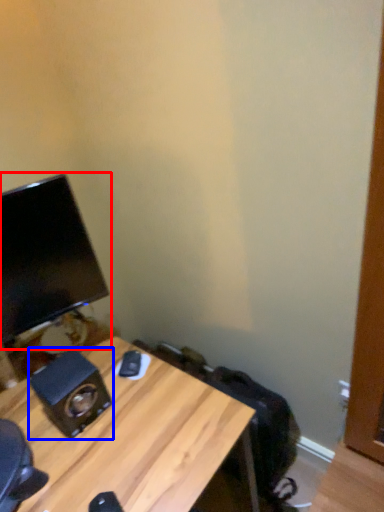
Question: Which point is closer to the camera, computer monitor (highlighted by a red box) or speaker (highlighted by a blue box)?

Choices:
 (A) computer monitor
 (B) speaker

Answer: (A)